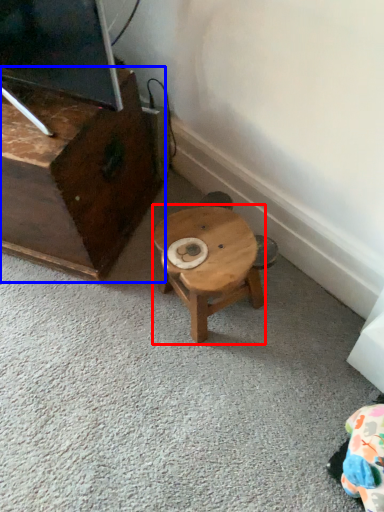
Question: Which object is further to the camera taking this photo, stool (highlighted by a red box) or furniture (highlighted by a blue box)?

Choices:
 (A) stool
 (B) furniture

Answer: (A)